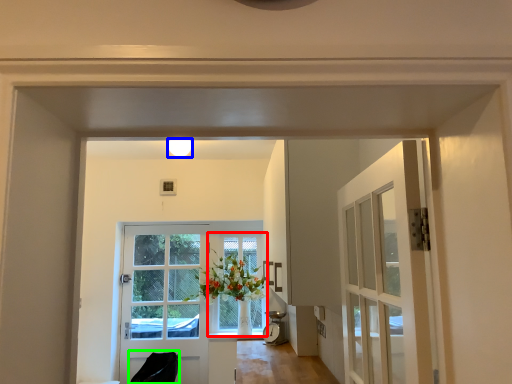
Question: Which object is the closest to the window (highlighted by a red box)? Choose among these: light fixture (highlighted by a blue box) or chair (highlighted by a green box).

Choices:
 (A) light fixture
 (B) chair

Answer: (B)